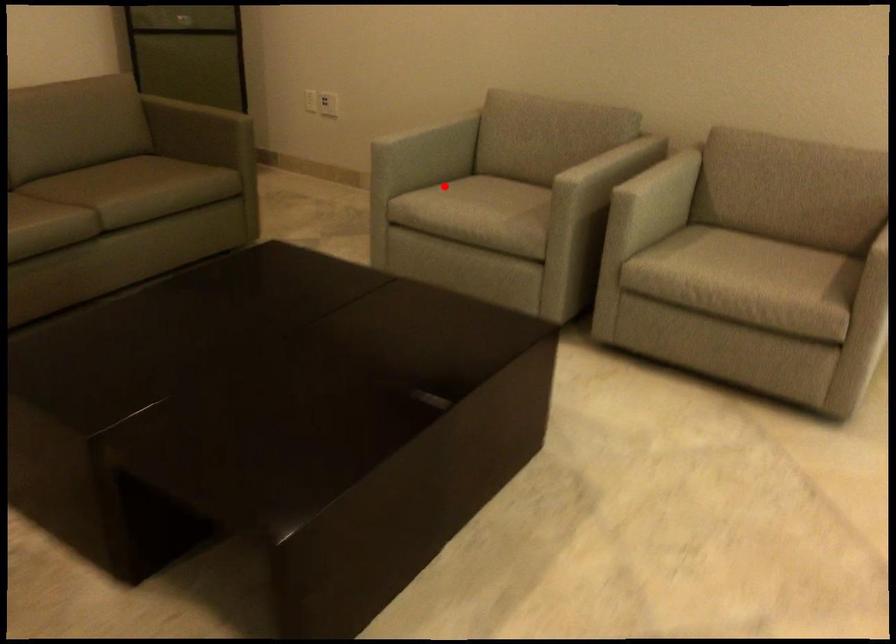
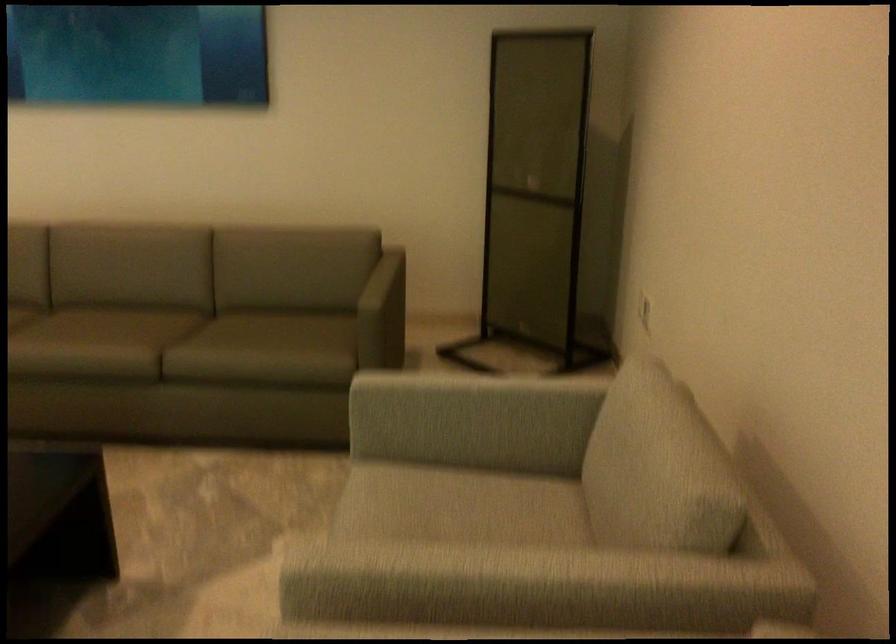
Locate, in the second image, the point that corresponds to the highlighted location in the first image.

(455, 491)